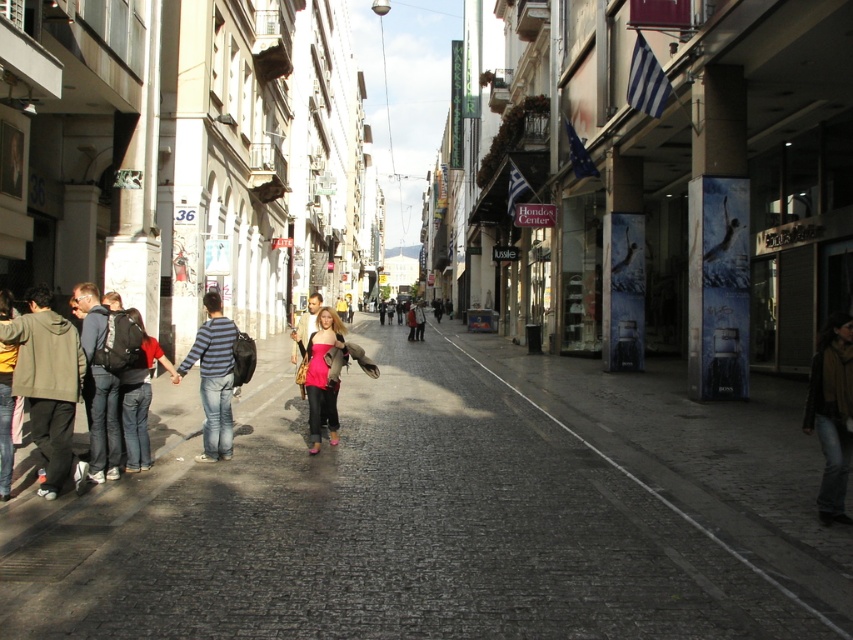
You are a traveler who just arrived in this European city and are looking for a place to buy a souvenir. You see a brown woolen scarf at lower right and a denim jacket at left. Which item is shorter in height?

The brown woolen scarf at lower right is shorter than the denim jacket at left.

You are a traveler who just arrived in this European city and are standing on the cobblestone street. You notice a brown woolen scarf at lower right and a denim jacket at left. Which item is wider?

The brown woolen scarf at lower right is wider than the denim jacket at left.

You are standing at the point with coordinates (445,509) in the image. What is located exactly at this point?

The gray cobblestone pavement at center is located exactly at point (445,509).